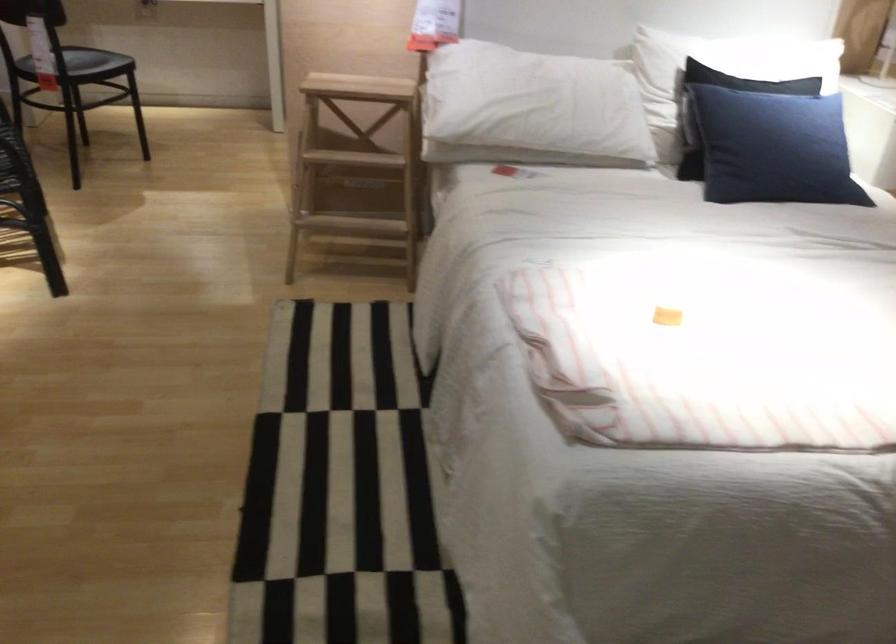
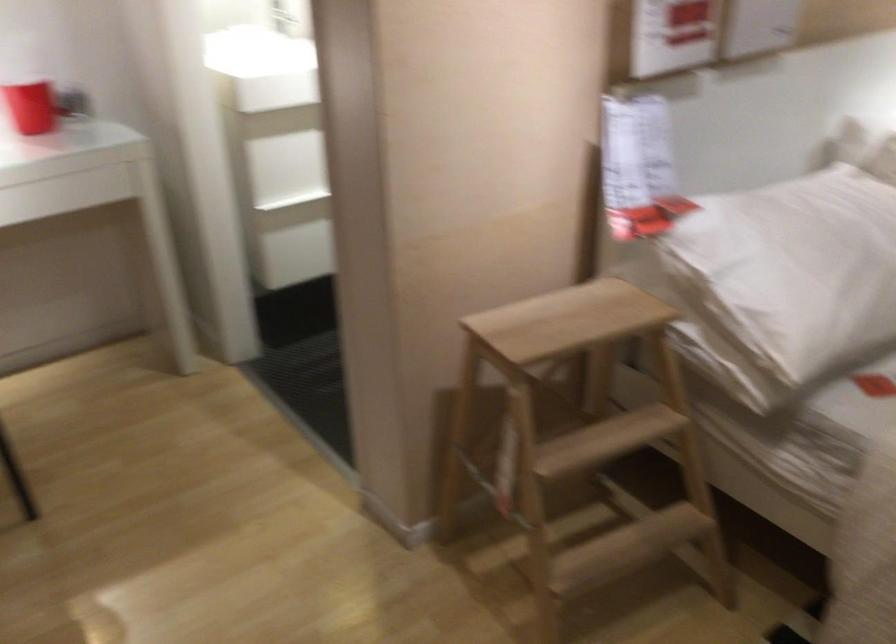
Where in the second image is the point corresponding to [469,89] from the first image?

(785, 281)